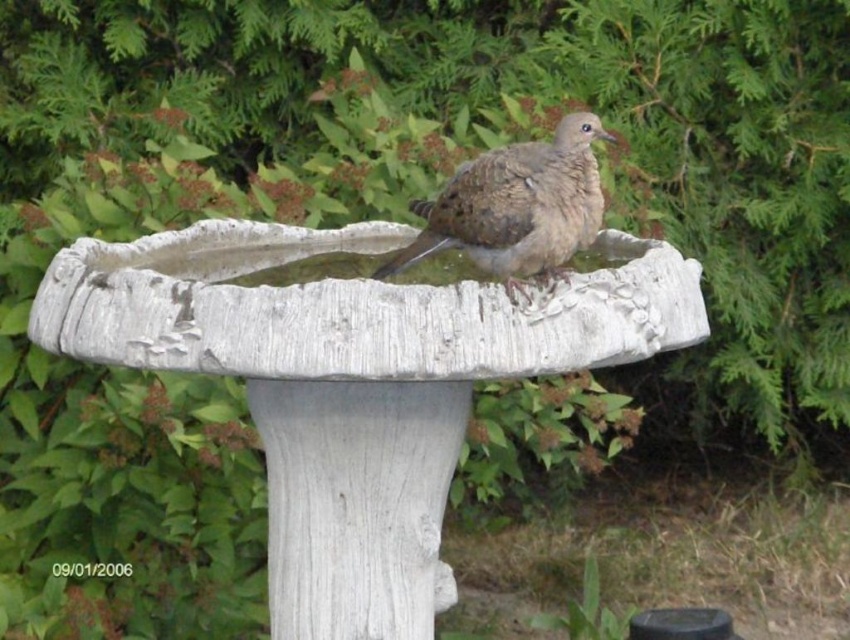
You are a photographer aiming to capture the brown speckled bird at center and the white concrete bird bath at center in a single frame. Based on their positions, which object should you adjust your camera focus on first to ensure both are in the frame?

The white concrete bird bath at center is to the left of brown speckled bird at center, so you should focus on the brown speckled bird at center first to ensure both are within the frame.

You are a bird watcher trying to observe the brown speckled bird at center from a distance. The white concrete bird bath at center is blocking your view. Can you estimate whether the bird is taller than the bird bath?

The white concrete bird bath at center is taller than the brown speckled bird at center, so the bird is not taller than the bird bath.